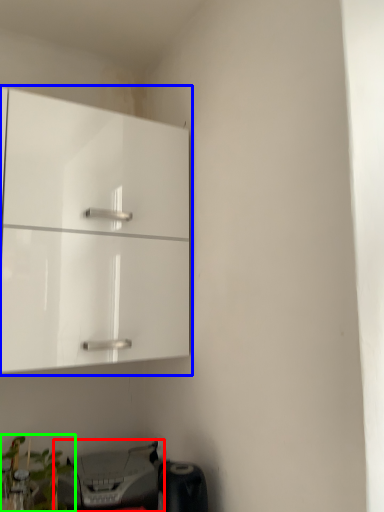
Question: Based on their relative distances, which object is farther from printer (highlighted by a red box)? Choose from cabinetry (highlighted by a blue box) and plant (highlighted by a green box).

Choices:
 (A) cabinetry
 (B) plant

Answer: (A)